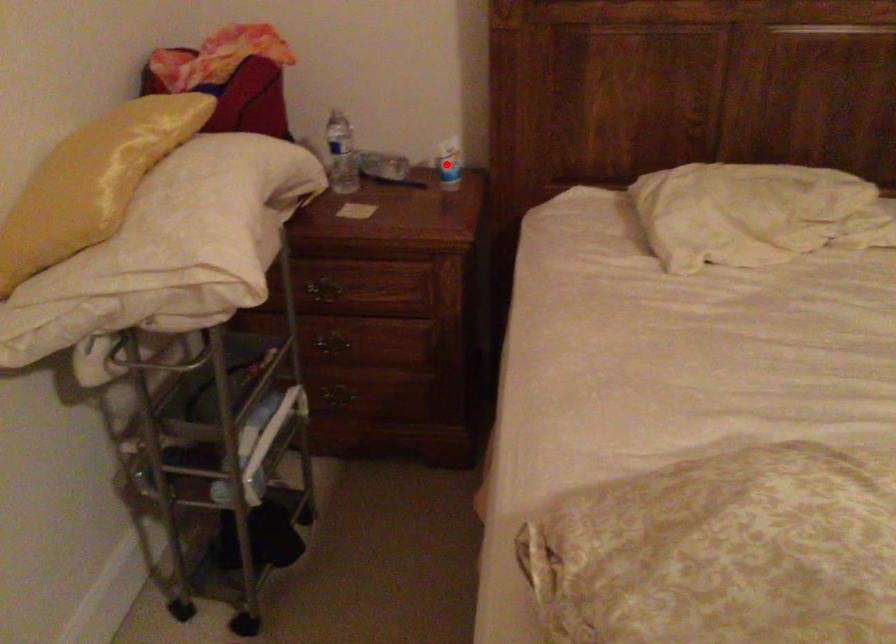
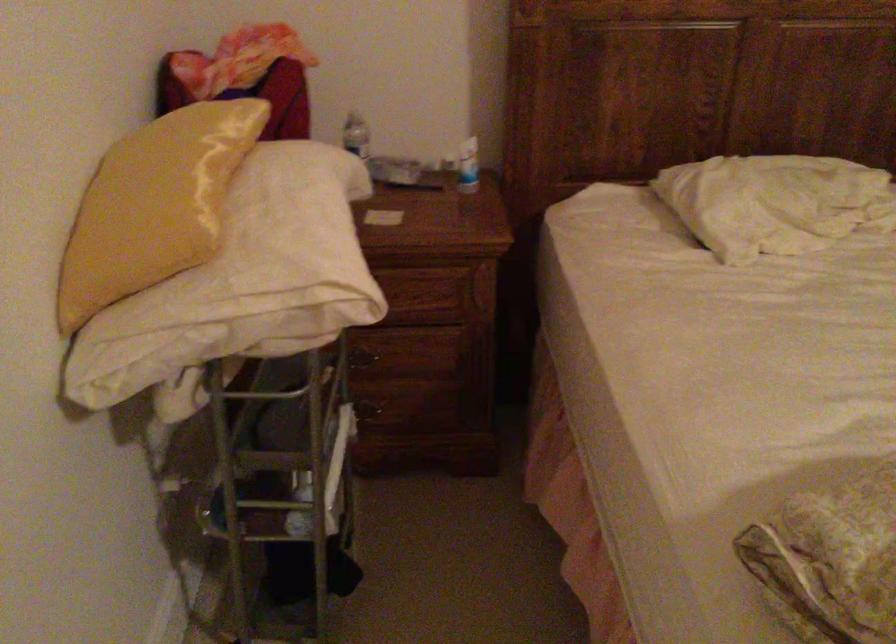
In the second image, find the point that corresponds to the highlighted location in the first image.

(468, 166)